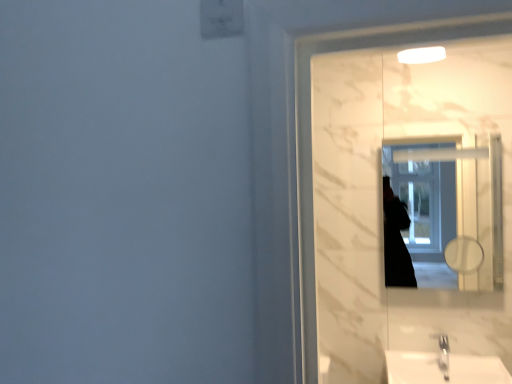
Question: Can you confirm if white glossy sink at lower right is positioned to the right of white glossy mirror at upper right?

Choices:
 (A) no
 (B) yes

Answer: (B)

Question: Is white glossy sink at lower right positioned with its back to white glossy mirror at upper right?

Choices:
 (A) no
 (B) yes

Answer: (A)

Question: Does white glossy sink at lower right have a lesser height compared to white glossy mirror at upper right?

Choices:
 (A) no
 (B) yes

Answer: (B)

Question: From the image's perspective, is white glossy sink at lower right over white glossy mirror at upper right?

Choices:
 (A) no
 (B) yes

Answer: (A)

Question: Is white glossy sink at lower right further to camera compared to white glossy mirror at upper right?

Choices:
 (A) yes
 (B) no

Answer: (B)

Question: Considering the relative sizes of white glossy sink at lower right and white glossy mirror at upper right in the image provided, is white glossy sink at lower right bigger than white glossy mirror at upper right?

Choices:
 (A) no
 (B) yes

Answer: (B)

Question: From the image's perspective, is white glossy mirror at upper right over white glossy sink at lower right?

Choices:
 (A) no
 (B) yes

Answer: (B)

Question: Can you confirm if white glossy mirror at upper right is bigger than white glossy sink at lower right?

Choices:
 (A) no
 (B) yes

Answer: (A)

Question: Is white glossy mirror at upper right far away from white glossy sink at lower right?

Choices:
 (A) yes
 (B) no

Answer: (A)

Question: Can you confirm if white glossy mirror at upper right is taller than white glossy sink at lower right?

Choices:
 (A) yes
 (B) no

Answer: (A)

Question: Does white glossy mirror at upper right have a lesser height compared to white glossy sink at lower right?

Choices:
 (A) yes
 (B) no

Answer: (B)

Question: Could you tell me if white glossy mirror at upper right is turned towards white glossy sink at lower right?

Choices:
 (A) no
 (B) yes

Answer: (A)

Question: Considering the positions of white glossy mirror at upper right and white glossy sink at lower right in the image, is white glossy mirror at upper right taller or shorter than white glossy sink at lower right?

Choices:
 (A) short
 (B) tall

Answer: (B)